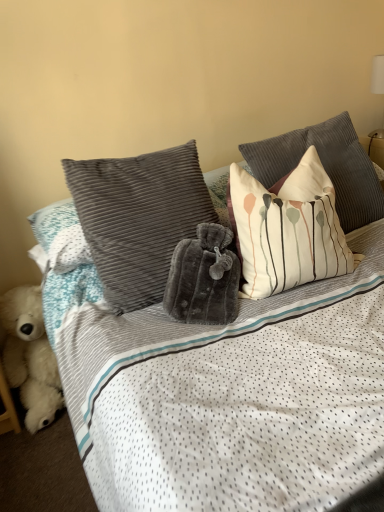
Question: From a real-world perspective, is white fluffy teddy bear at lower left located higher than white striped pillow at upper right, which is counted as the 2th pillow, starting from the right?

Choices:
 (A) yes
 (B) no

Answer: (B)

Question: Is white fluffy teddy bear at lower left not close to white striped pillow at upper right, which is counted as the 2th pillow, starting from the right?

Choices:
 (A) no
 (B) yes

Answer: (A)

Question: Is white fluffy teddy bear at lower left located outside white striped pillow at upper right, marked as the 2th pillow in a left-to-right arrangement?

Choices:
 (A) no
 (B) yes

Answer: (B)

Question: Can you confirm if white fluffy teddy bear at lower left is positioned to the right of white striped pillow at upper right, which is counted as the 2th pillow, starting from the right?

Choices:
 (A) no
 (B) yes

Answer: (A)

Question: Is white fluffy teddy bear at lower left positioned behind white striped pillow at upper right, marked as the 2th pillow in a left-to-right arrangement?

Choices:
 (A) yes
 (B) no

Answer: (A)

Question: Based on their sizes in the image, would you say white cotton pillow with abstract design at upper right, positioned as the third pillow in left-to-right order, is bigger or smaller than white striped pillow at upper right, which is counted as the 2th pillow, starting from the right?

Choices:
 (A) big
 (B) small

Answer: (A)

Question: Is white cotton pillow with abstract design at upper right, which is the 1th pillow from right to left, taller or shorter than white striped pillow at upper right, marked as the 2th pillow in a left-to-right arrangement?

Choices:
 (A) tall
 (B) short

Answer: (B)

Question: Is white cotton pillow with abstract design at upper right, positioned as the third pillow in left-to-right order, inside or outside of white striped pillow at upper right, marked as the 2th pillow in a left-to-right arrangement?

Choices:
 (A) outside
 (B) inside

Answer: (A)

Question: In the image, is white cotton pillow with abstract design at upper right, positioned as the third pillow in left-to-right order, positioned in front of or behind white striped pillow at upper right, marked as the 2th pillow in a left-to-right arrangement?

Choices:
 (A) front
 (B) behind

Answer: (B)

Question: Is white cotton pillow with abstract design at upper right, which is the 1th pillow from right to left, to the left or to the right of velvety gray pillow at center, placed as the 3th pillow when sorted from right to left, in the image?

Choices:
 (A) right
 (B) left

Answer: (A)

Question: Is white cotton pillow with abstract design at upper right, positioned as the third pillow in left-to-right order, wider or thinner than velvety gray pillow at center, which appears as the first pillow when viewed from the left?

Choices:
 (A) thin
 (B) wide

Answer: (B)

Question: Looking at the image, does white cotton pillow with abstract design at upper right, positioned as the third pillow in left-to-right order, seem bigger or smaller compared to velvety gray pillow at center, which appears as the first pillow when viewed from the left?

Choices:
 (A) small
 (B) big

Answer: (B)

Question: Is point (347, 117) closer or farther from the camera than point (132, 263)?

Choices:
 (A) closer
 (B) farther

Answer: (B)

Question: Looking at their shapes, would you say velvety gray pillow at center, which appears as the first pillow when viewed from the left, is wider or thinner than white cotton pillow with abstract design at upper right, positioned as the third pillow in left-to-right order?

Choices:
 (A) wide
 (B) thin

Answer: (B)

Question: Is velvety gray pillow at center, placed as the 3th pillow when sorted from right to left, bigger or smaller than white cotton pillow with abstract design at upper right, positioned as the third pillow in left-to-right order?

Choices:
 (A) big
 (B) small

Answer: (B)